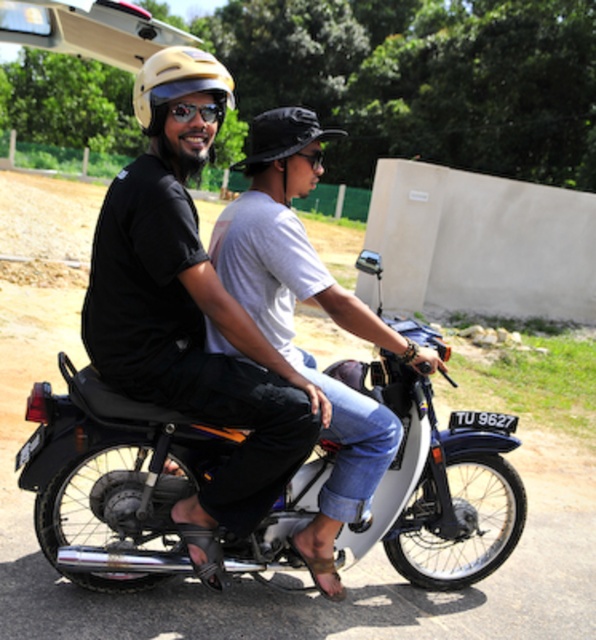
Does black matte bucket hat at center have a larger size compared to brushed metal goggles at upper center?

Yes, black matte bucket hat at center is bigger than brushed metal goggles at upper center.

Does black matte bucket hat at center appear under brushed metal goggles at upper center?

No.

Is point (299, 129) positioned before point (213, 109)?

No, (299, 129) is behind (213, 109).

Identify the location of black matte bucket hat at center. The width and height of the screenshot is (596, 640). (283, 134).

Is matte yellow helmet at upper left closer to camera compared to brushed metal goggles at upper center?

That is False.

Is matte yellow helmet at upper left thinner than brushed metal goggles at upper center?

In fact, matte yellow helmet at upper left might be wider than brushed metal goggles at upper center.

Between point (218, 97) and point (184, 113), which one is positioned behind?

Point (218, 97)

Identify the location of matte yellow helmet at upper left. (178, 83).

Can you confirm if matte black helmet at upper left is smaller than matte yellow helmet at upper left?

Yes.

Between point (291, 211) and point (163, 99), which one is positioned in front?

Positioned in front is point (163, 99).

You are a GUI agent. You are given a task and a screenshot of the screen. Output one action in this format:
    pyautogui.click(x=<x>, y=<y>)
    Task: Click on the matte black helmet at upper left
    Image resolution: width=596 pixels, height=640 pixels.
    Given the screenshot: What is the action you would take?
    (x=234, y=317)